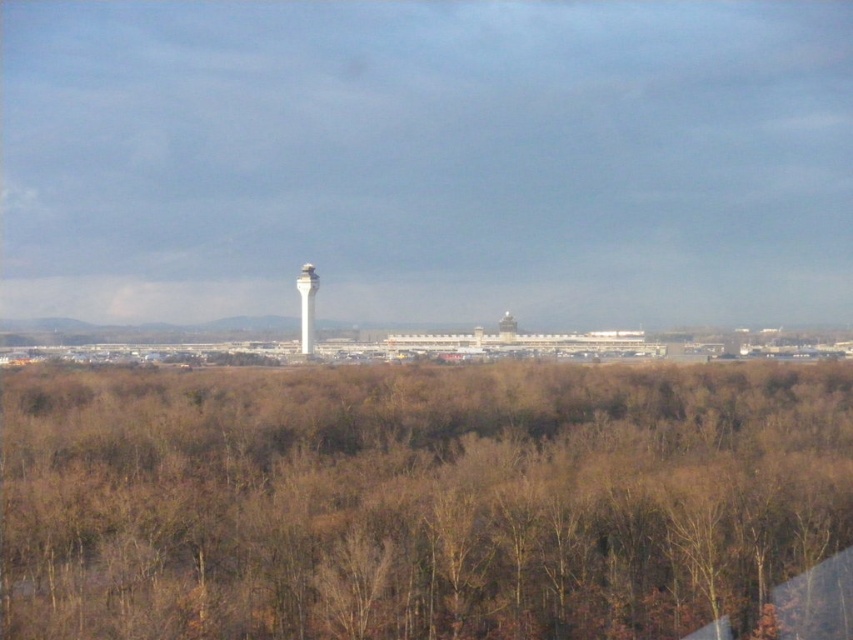
Question: In this image, where is brown leafless trees at center located relative to white smooth tower at center?

Choices:
 (A) above
 (B) below

Answer: (B)

Question: Does brown leafless trees at center have a larger size compared to white smooth tower at center?

Choices:
 (A) yes
 (B) no

Answer: (A)

Question: Is the position of brown leafless trees at center more distant than that of white smooth tower at center?

Choices:
 (A) no
 (B) yes

Answer: (A)

Question: Which of the following is the farthest from the observer?

Choices:
 (A) 308,330
 (B) 215,524

Answer: (A)